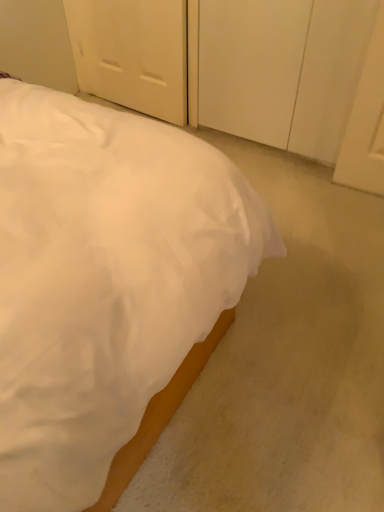
Find the location of `white matte bed at center`. white matte bed at center is located at coordinates (104, 280).

The image size is (384, 512). What do you see at coordinates (104, 280) in the screenshot? I see `white matte bed at center` at bounding box center [104, 280].

This screenshot has width=384, height=512. In order to click on white matte bed at center in this screenshot , I will do `click(104, 280)`.